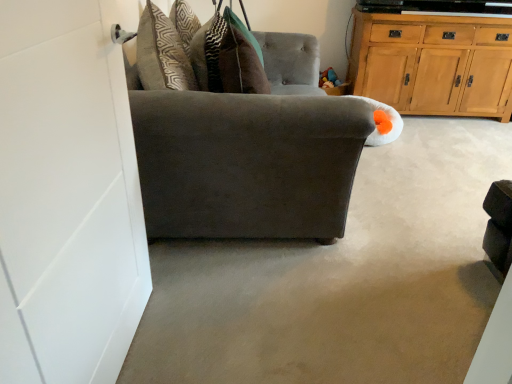
What do you see at coordinates (246, 163) in the screenshot? This screenshot has width=512, height=384. I see `suede gray chair at left` at bounding box center [246, 163].

You are a GUI agent. You are given a task and a screenshot of the screen. Output one action in this format:
    pyautogui.click(x=<x>, y=<y>)
    Task: Click on the suede gray chair at left
    The image size is (512, 384).
    Given the screenshot: What is the action you would take?
    [x=246, y=163]

Image resolution: width=512 pixels, height=384 pixels. Describe the element at coordinates (433, 63) in the screenshot. I see `wooden cabinet at upper right` at that location.

The width and height of the screenshot is (512, 384). Find the location of `dark gray fabric couch at center`. dark gray fabric couch at center is located at coordinates (341, 279).

This screenshot has width=512, height=384. Find the location of `suede gray chair at left`. suede gray chair at left is located at coordinates (246, 163).

From the image's perspective, which one is positioned higher, wooden cabinet at upper right or suede gray chair at left?

wooden cabinet at upper right, from the image's perspective.

Is wooden cabinet at upper right inside the boundaries of suede gray chair at left, or outside?

The correct answer is: outside.

Is there a large distance between wooden cabinet at upper right and suede gray chair at left?

That's right, there is a large distance between wooden cabinet at upper right and suede gray chair at left.

Can you confirm if wooden cabinet at upper right is positioned to the left of suede gray chair at left?

No, wooden cabinet at upper right is not to the left of suede gray chair at left.

Who is bigger, dark gray fabric couch at center or wooden cabinet at upper right?

Bigger between the two is wooden cabinet at upper right.

Does point (371, 172) lie in front of point (359, 58)?

Yes, it is.

Does dark gray fabric couch at center have a lesser height compared to wooden cabinet at upper right?

Correct, dark gray fabric couch at center is not as tall as wooden cabinet at upper right.

Measure the distance between dark gray fabric couch at center and wooden cabinet at upper right.

4.30 feet.

Based on their sizes in the image, would you say wooden cabinet at upper right is bigger or smaller than dark gray fabric couch at center?

In the image, wooden cabinet at upper right appears to be larger than dark gray fabric couch at center.

From the image's perspective, is wooden cabinet at upper right below dark gray fabric couch at center?

Actually, wooden cabinet at upper right appears above dark gray fabric couch at center in the image.

Is wooden cabinet at upper right further to the viewer compared to dark gray fabric couch at center?

Yes, it is behind dark gray fabric couch at center.

Looking at this image, is wooden cabinet at upper right not within dark gray fabric couch at center?

Yes, wooden cabinet at upper right is outside of dark gray fabric couch at center.

Which of these two, suede gray chair at left or wooden cabinet at upper right, stands taller?

wooden cabinet at upper right is taller.

Consider the image. Which is correct: suede gray chair at left is inside wooden cabinet at upper right, or outside of it?

suede gray chair at left is not enclosed by wooden cabinet at upper right.

How different are the orientations of suede gray chair at left and wooden cabinet at upper right in degrees?

The angle between the facing direction of suede gray chair at left and the facing direction of wooden cabinet at upper right is 91.3 degrees.

What are the coordinates of `chair lying below the wooden cabinet at upper right (from the image's perspective)` in the screenshot? It's located at (246, 163).

Which of these two, suede gray chair at left or dark gray fabric couch at center, stands shorter?

With less height is dark gray fabric couch at center.

Can you tell me how much suede gray chair at left and dark gray fabric couch at center differ in facing direction?

89.8 degrees separate the facing orientations of suede gray chair at left and dark gray fabric couch at center.

Looking at their sizes, would you say suede gray chair at left is wider or thinner than dark gray fabric couch at center?

Clearly, suede gray chair at left has less width compared to dark gray fabric couch at center.

Is suede gray chair at left turned away from dark gray fabric couch at center?

No, suede gray chair at left is not facing away from dark gray fabric couch at center.

From a real-world perspective, is dark gray fabric couch at center positioned over suede gray chair at left based on gravity?

Incorrect, from a real-world perspective, dark gray fabric couch at center is lower than suede gray chair at left.

Is dark gray fabric couch at center behind suede gray chair at left?

No, the depth of dark gray fabric couch at center is less than that of suede gray chair at left.

Is dark gray fabric couch at center taller than suede gray chair at left?

In fact, dark gray fabric couch at center may be shorter than suede gray chair at left.

Can you confirm if dark gray fabric couch at center is positioned to the left of suede gray chair at left?

In fact, dark gray fabric couch at center is to the right of suede gray chair at left.

You are a GUI agent. You are given a task and a screenshot of the screen. Output one action in this format:
    pyautogui.click(x=<x>, y=<y>)
    Task: Click on the cabinetry that appears behind the suede gray chair at left
    The height and width of the screenshot is (384, 512).
    Given the screenshot: What is the action you would take?
    pyautogui.click(x=433, y=63)

Image resolution: width=512 pixels, height=384 pixels. I want to click on concrete that is below the wooden cabinet at upper right (from the image's perspective), so [341, 279].

Based on their spatial positions, is dark gray fabric couch at center or wooden cabinet at upper right further from suede gray chair at left?

Among the two, wooden cabinet at upper right is located further to suede gray chair at left.

Looking at the image, which one is located further to dark gray fabric couch at center, wooden cabinet at upper right or suede gray chair at left?

wooden cabinet at upper right.

Estimate the real-world distances between objects in this image. Which object is further from suede gray chair at left, wooden cabinet at upper right or dark gray fabric couch at center?

Based on the image, wooden cabinet at upper right appears to be further to suede gray chair at left.

Estimate the real-world distances between objects in this image. Which object is further from dark gray fabric couch at center, suede gray chair at left or wooden cabinet at upper right?

Based on the image, wooden cabinet at upper right appears to be further to dark gray fabric couch at center.

Based on their spatial positions, is suede gray chair at left or dark gray fabric couch at center closer to wooden cabinet at upper right?

The object closer to wooden cabinet at upper right is dark gray fabric couch at center.

Estimate the real-world distances between objects in this image. Which object is closer to wooden cabinet at upper right, dark gray fabric couch at center or suede gray chair at left?

Based on the image, dark gray fabric couch at center appears to be nearer to wooden cabinet at upper right.

Locate an element on the screen. This screenshot has height=384, width=512. chair positioned between dark gray fabric couch at center and wooden cabinet at upper right from near to far is located at coordinates (246, 163).